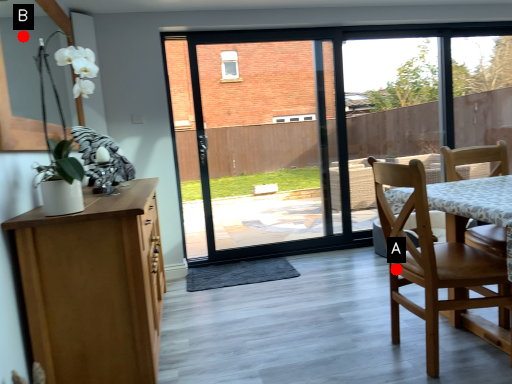
Question: Two points are circled on the image, labeled by A and B beside each circle. Among these points, which one is farthest from the camera?

Choices:
 (A) A is further
 (B) B is further

Answer: (B)